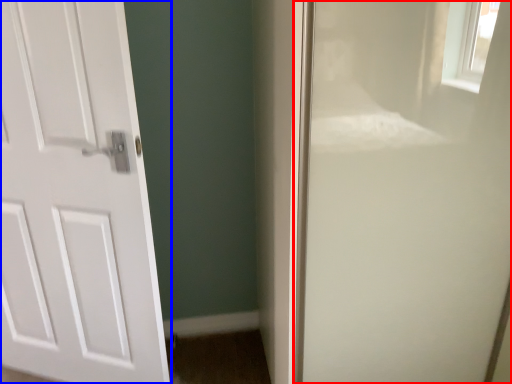
Question: Which object appears closest to the camera in this image, screen door (highlighted by a red box) or door (highlighted by a blue box)?

Choices:
 (A) screen door
 (B) door

Answer: (A)